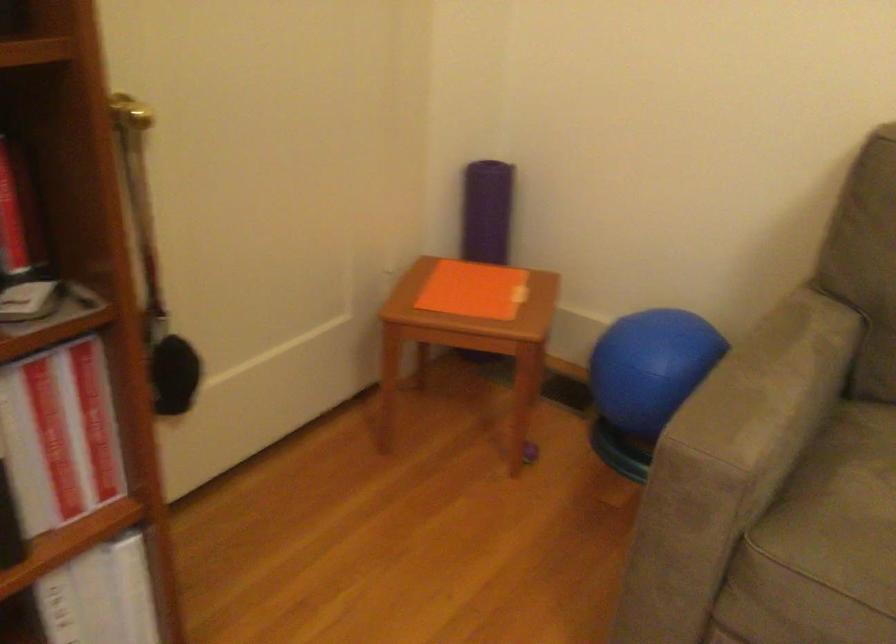
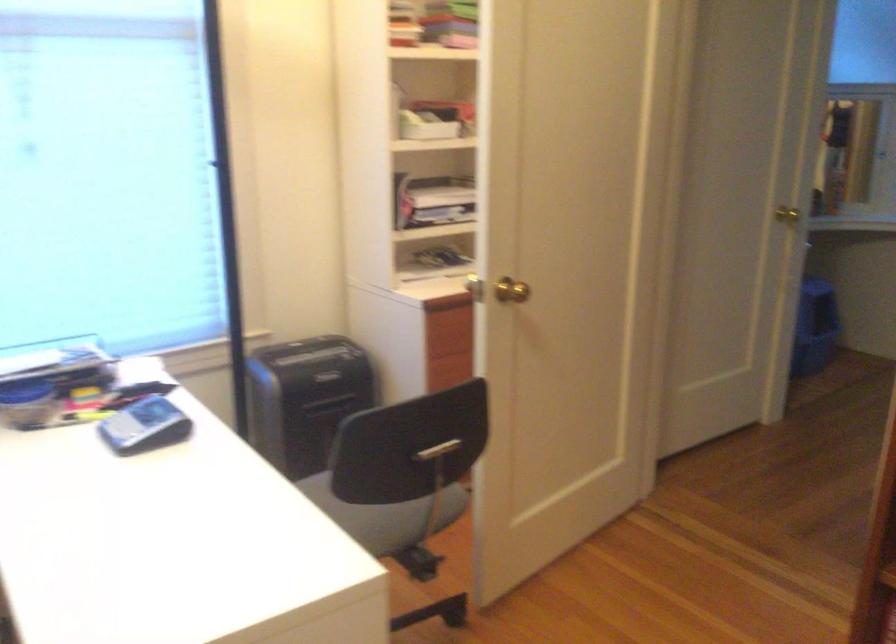
How did the camera likely rotate?

The camera rotated toward left-down.